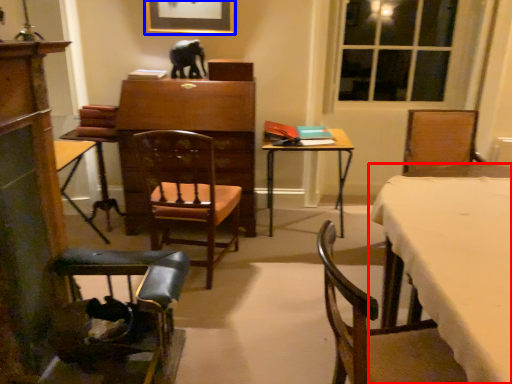
Question: Which point is closer to the camera, desk (highlighted by a red box) or picture frame (highlighted by a blue box)?

Choices:
 (A) desk
 (B) picture frame

Answer: (A)